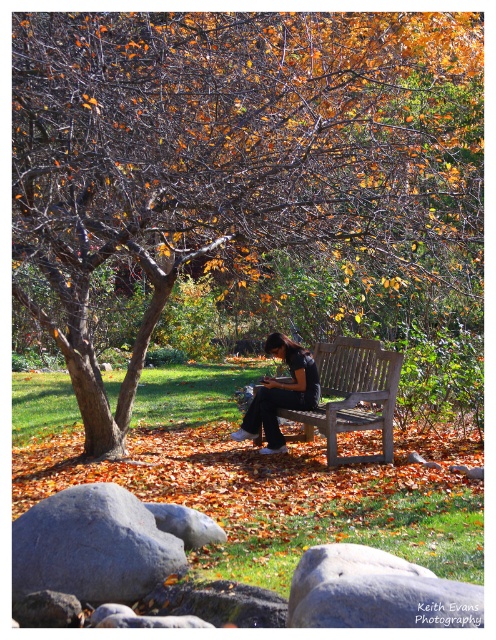
You are a photographer trying to capture a photo of the brown wood tree at center and the black fabric shirt at center from the ground level. Which object will appear closer to the top of your camera viewfinder?

The brown wood tree at center is located above the black fabric shirt at center, so it will appear closer to the top of the camera viewfinder.

You are standing at the point marked by coordinates point (227, 150) in the scene. What object are you directly at?

You are directly at the brown wood tree at center, as the coordinates point (227, 150) indicate this object.

You are a photographer trying to capture the wooden bench at center and the black fabric shirt at center in the same frame. Based on their positions, which object is closer to the right edge of the photo?

The wooden bench at center is positioned on the right side of black fabric shirt at center, so the wooden bench at center is closer to the right edge of the photo.